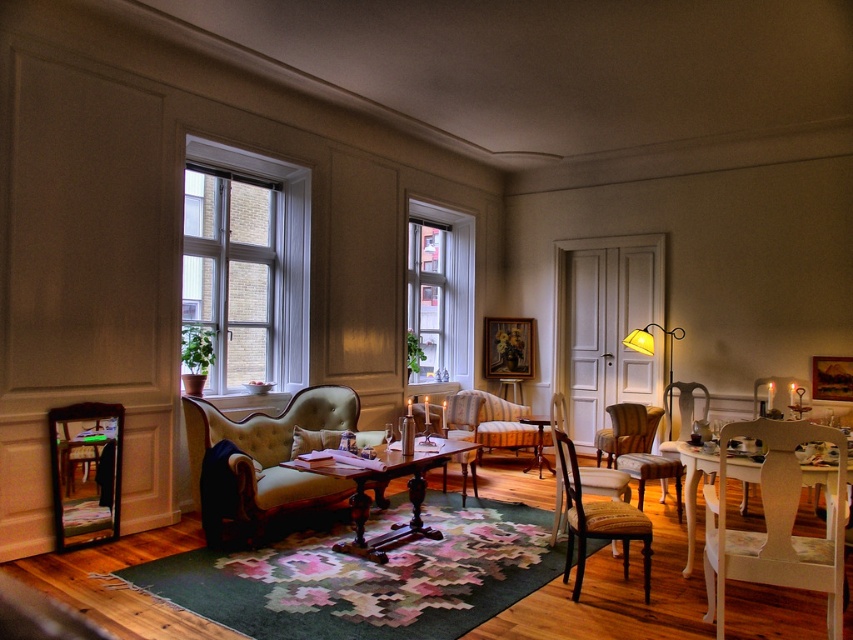
What are the coordinates of the velvet green armchair at center?

The velvet green armchair at center is located at coordinates point (664, 442).

You are standing in the living room and want to determine which of the two points, point (605, 480) or point (648, 353), is closer to you. Based on the scene description, which point is nearer?

Point (605, 480) is closer to the camera than point (648, 353), so it is nearer to you.